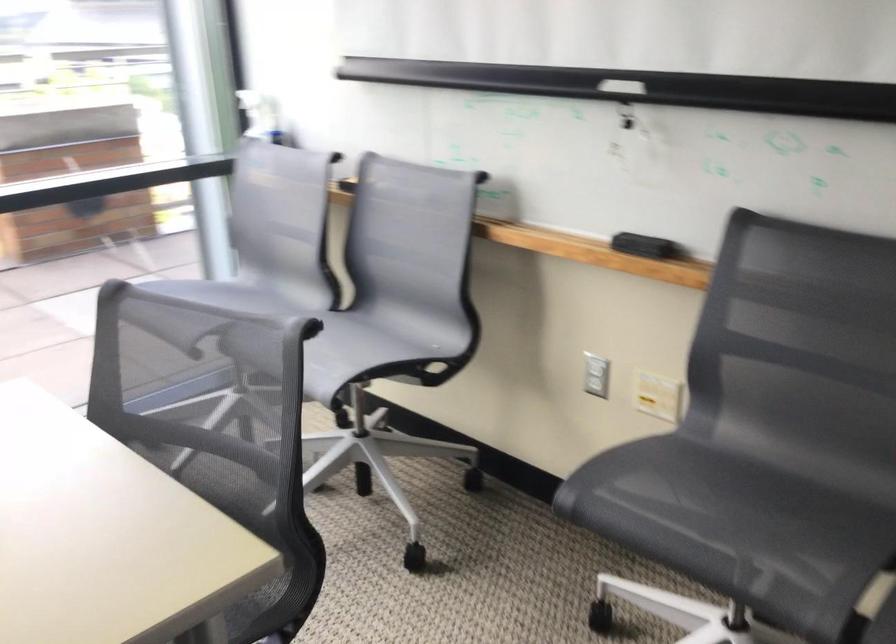
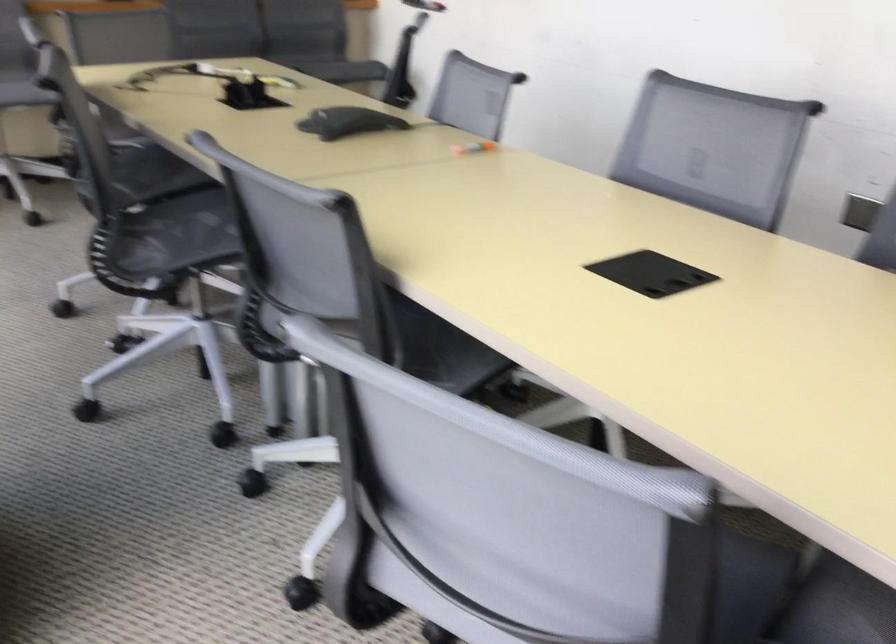
Question: I am providing you with two images of the same scene from different viewpoints. After the viewpoint changes to image2, which objects are now occluded?

Choices:
 (A) white light switch
 (B) tripod tilt handle
 (C) chair sitting surface
 (D) black conference phone

Answer: (A)